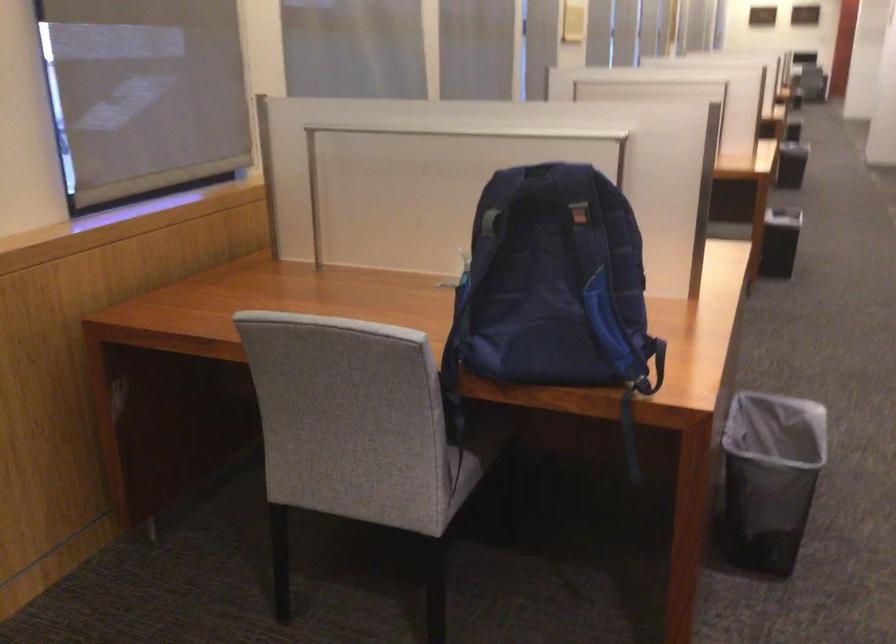
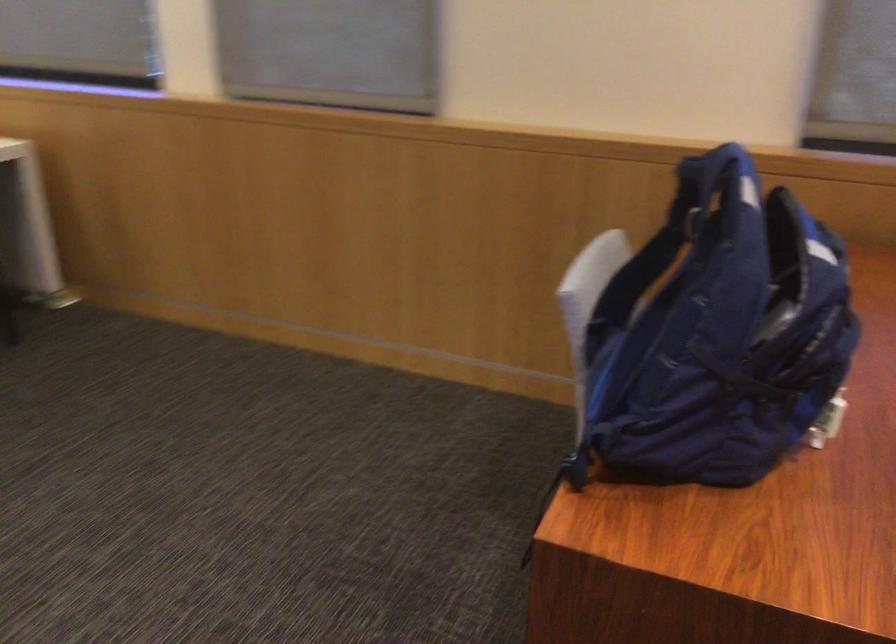
The point at (572, 173) is marked in the first image. Where is the corresponding point in the second image?

(730, 178)